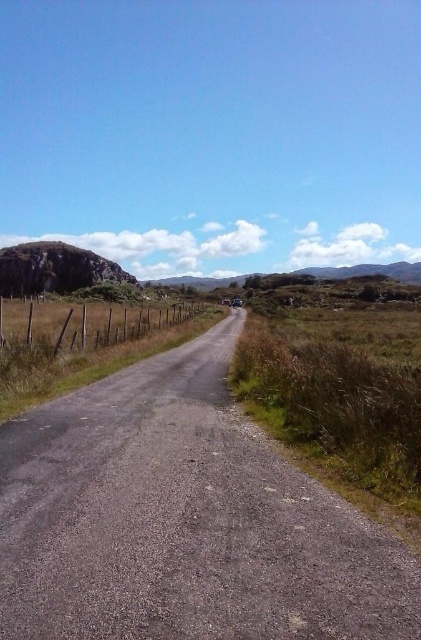
You are driving a truck that is 3 meters wide. You see the gray asphalt road at center and the brown wooden fence at left. Can your truck pass through the road without hitting the fence?

The gray asphalt road at center has a lesser width compared to brown wooden fence at left. Since the road is narrower than the fence, it might not be wide enough for a 3 meter wide truck to pass safely without hitting the fence. Consider taking a different route.